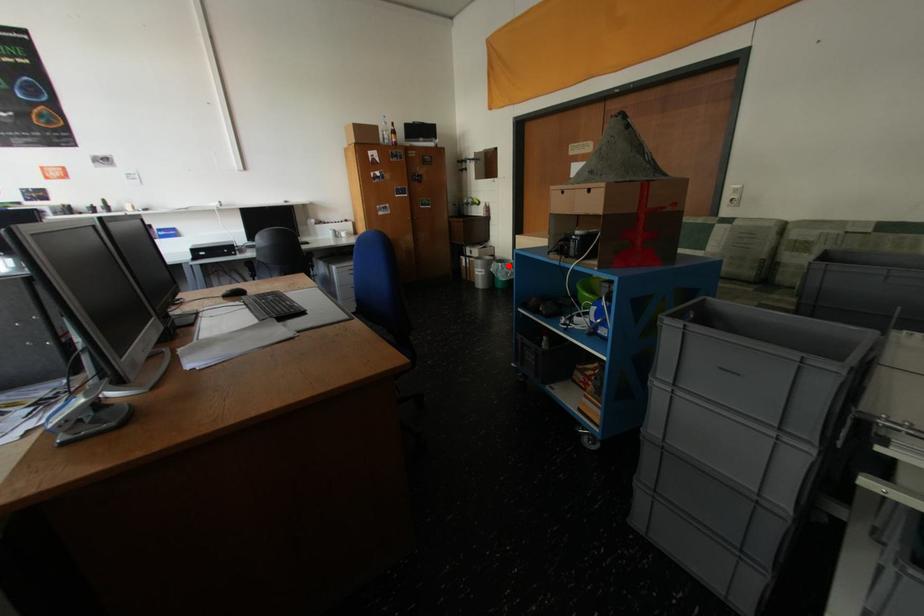
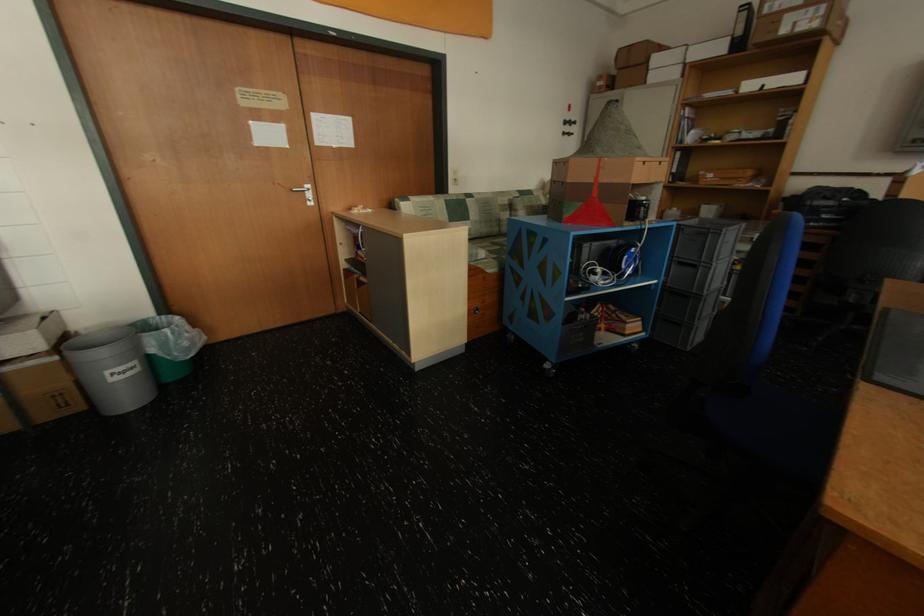
Question: I am providing you with two images of the same scene from different viewpoints. A red point is marked on the first image. Is the red point's position out of view in image 2?

Choices:
 (A) Yes
 (B) No

Answer: (B)